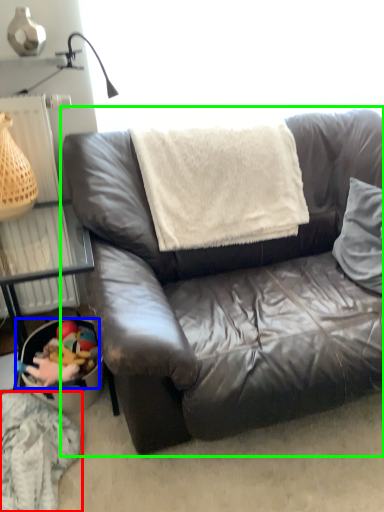
Question: Which object is positioned closest to material (highlighted by a red box)? Select from stuff (highlighted by a blue box) and studio couch (highlighted by a green box).

Choices:
 (A) stuff
 (B) studio couch

Answer: (A)